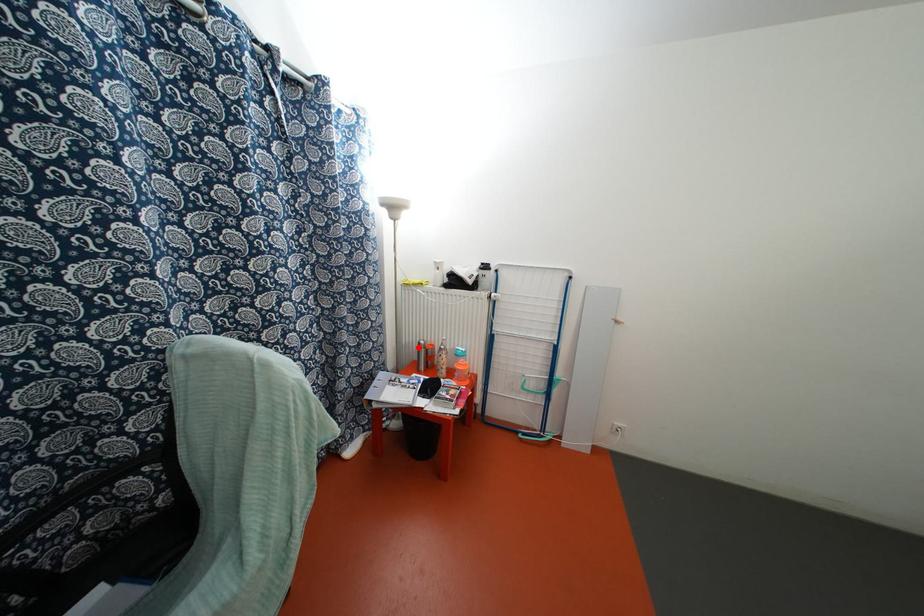
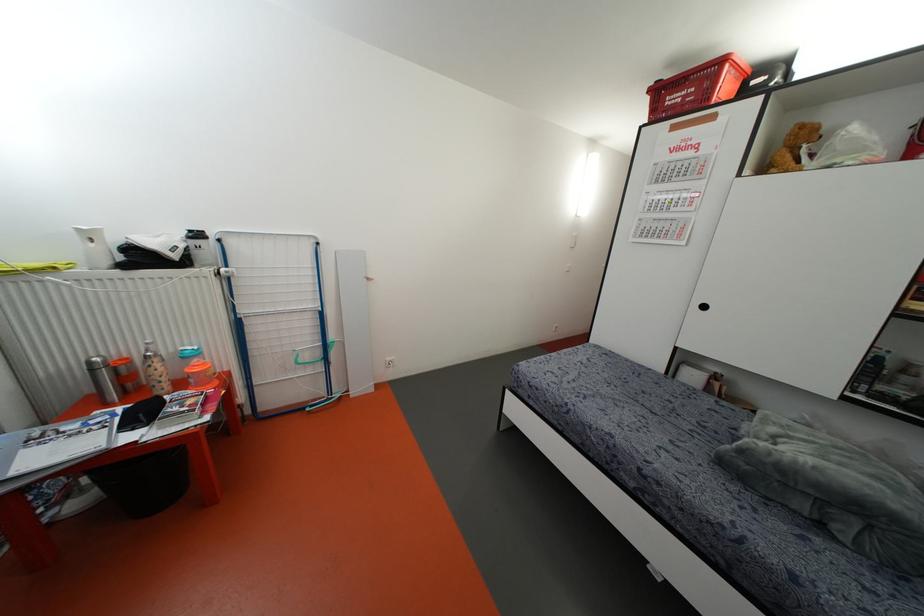
Question: I am providing you with two images of the same scene from different viewpoints. Image1 has a red point marked. In image2, the corresponding 3D location appears at what relative position? Reply with the corresponding letter.

Choices:
 (A) Closer
 (B) Farther

Answer: (A)